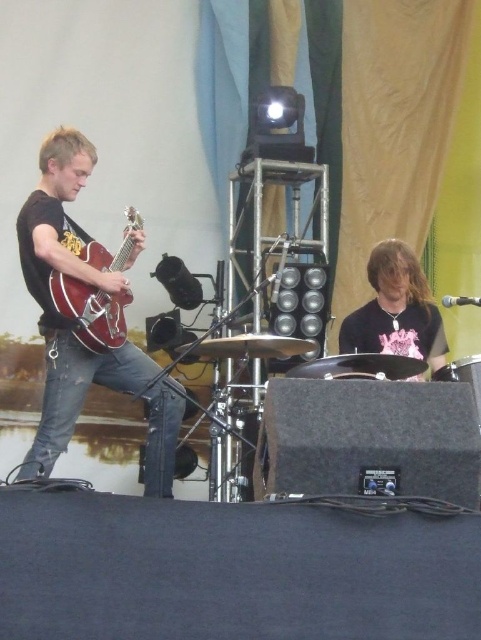
You are a stagehand setting up the lighting for the performance. You need to ensure that the light beams can reach both the matte black guitar at left and the black drum at center. Considering their heights, which object requires a higher positioned light fixture?

The matte black guitar at left is much taller than the black drum at center, so the light fixture for the matte black guitar at left needs to be positioned higher to ensure proper illumination.

You are a stagehand who needs to move the matte black guitar at left and the black drum at center to the storage room. Which object should you move first if you want to move them without disturbing the other?

You should move the matte black guitar at left first because it is positioned on the left side of the black drum at center, so moving it first would avoid blocking access to the drum.